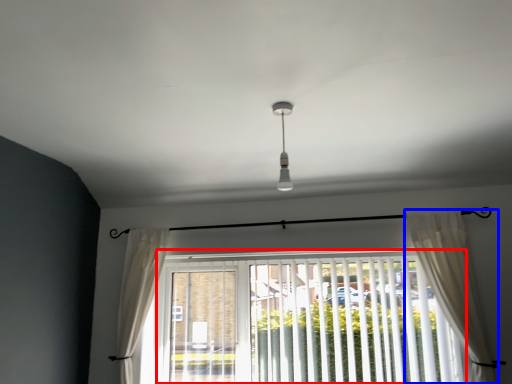
Question: Which of the following is the closest to the observer, window blind (highlighted by a red box) or curtain (highlighted by a blue box)?

Choices:
 (A) window blind
 (B) curtain

Answer: (B)